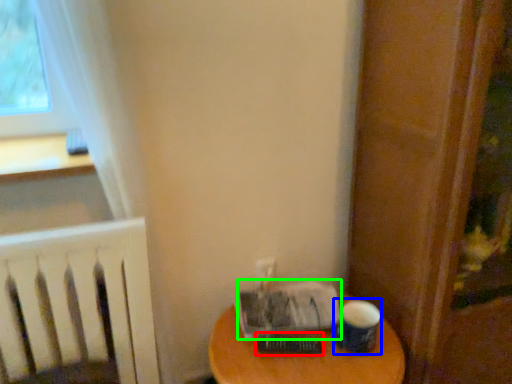
Question: Which object is the farthest from paperback book (highlighted by a red box)? Choose among these: paper cup (highlighted by a blue box) or paperback book (highlighted by a green box).

Choices:
 (A) paper cup
 (B) paperback book

Answer: (A)